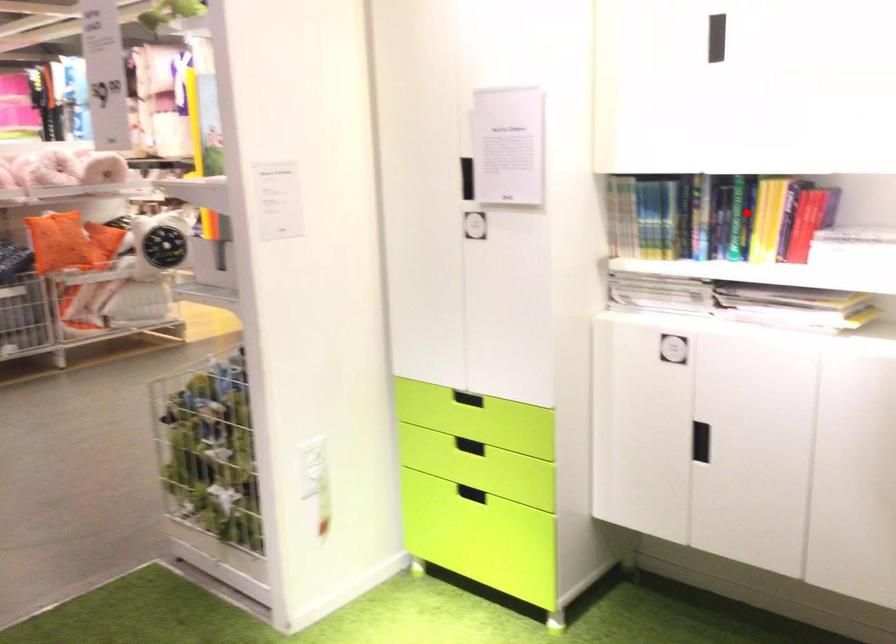
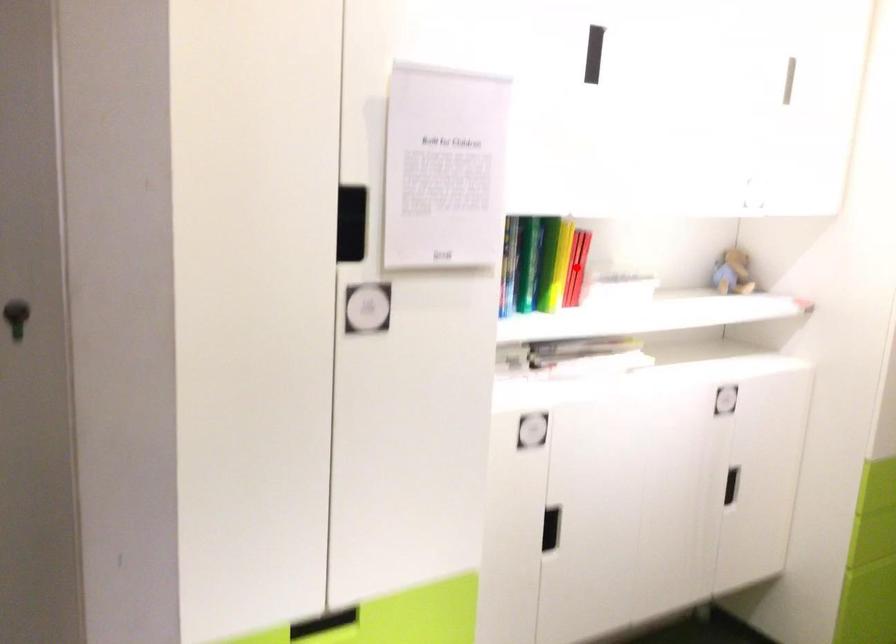
I am providing you with two images of the same scene from different viewpoints. A red point is marked on the first image and another point is marked on the second image. Do the highlighted points in image1 and image2 indicate the same real-world spot?

No